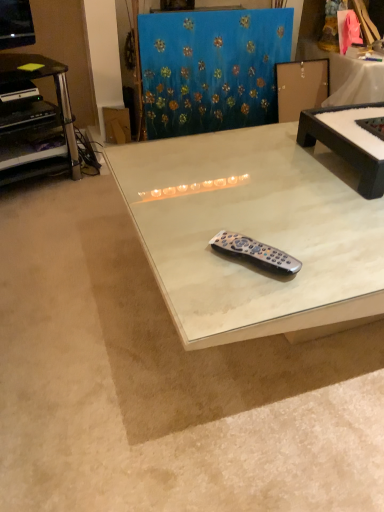
Where is `unoccupied region to the right of black plastic remote at center`? The height and width of the screenshot is (512, 384). unoccupied region to the right of black plastic remote at center is located at coordinates (330, 261).